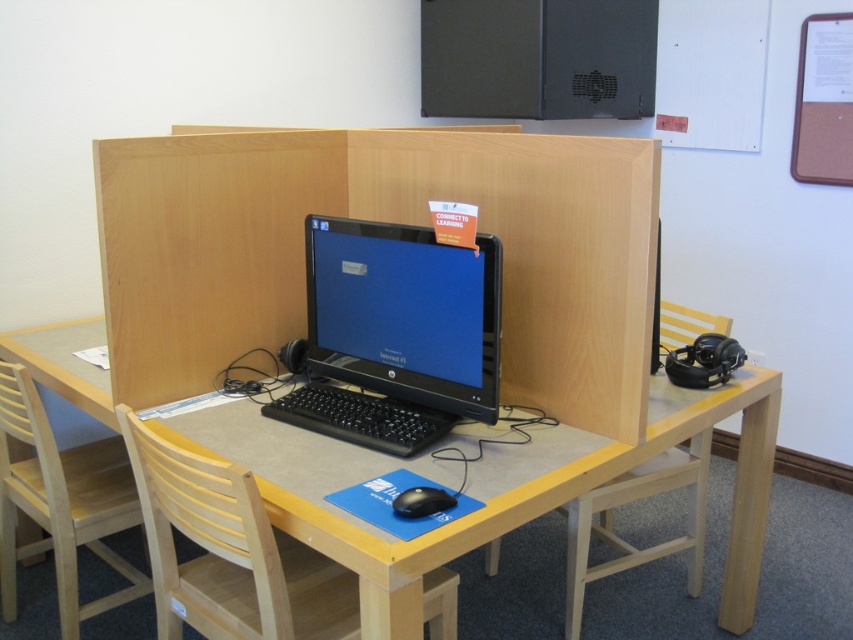
You are a person with a height of 1.7 meters. You are sitting on the light wood chair at lower left and want to reach the keyboard on the desk. Can you comfortably reach the keyboard?

The distance between the light wood chair at lower left and the viewer is 1.79 meters. Since the chair is 1.79 meters away from you, and your height is 1.7 meters, you might find it slightly challenging to comfortably reach the keyboard as the distance is greater than your height, potentially requiring stretching.